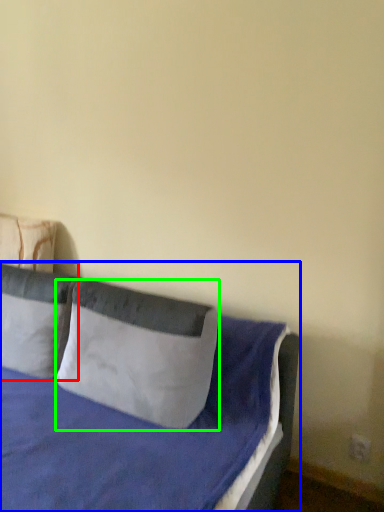
Question: Which object is positioned farthest from pillow (highlighted by a red box)? Select from bed (highlighted by a blue box) and pillow (highlighted by a green box).

Choices:
 (A) bed
 (B) pillow

Answer: (B)